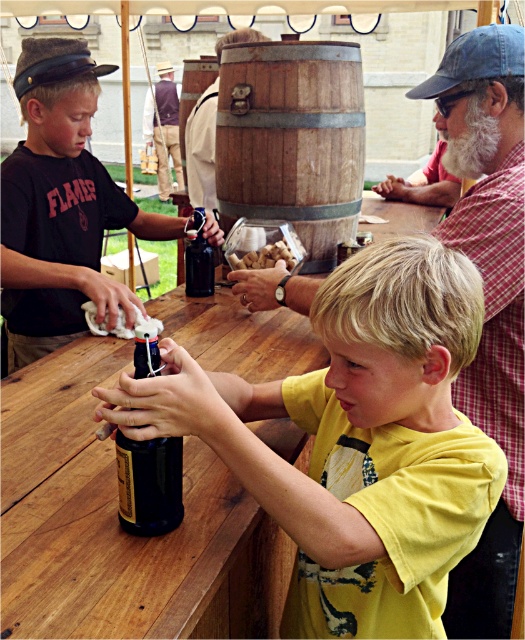
Question: Estimate the real-world distances between objects in this image. Which object is farther from the yellow matte shirt at center?

Choices:
 (A) brown leather vest at center
 (B) bearded man at upper right
 (C) dark blue glass bottle at center
 (D) wooden table at center

Answer: (A)

Question: Is the position of yellow matte shirt at center more distant than that of dark blue glass bottle at center?

Choices:
 (A) yes
 (B) no

Answer: (B)

Question: Is wooden barrel at center closer to the viewer compared to brown leather vest at center?

Choices:
 (A) yes
 (B) no

Answer: (A)

Question: Which object is the farthest from the bearded man at upper right?

Choices:
 (A) checkered shirt at upper right
 (B) yellow matte shirt at center
 (C) matte black shirt at left
 (D) dark brown glass bottle at center

Answer: (B)

Question: Which object appears closest to the camera in this image?

Choices:
 (A) wooden barrel at center
 (B) checkered shirt at upper right
 (C) brown leather vest at center
 (D) matte black shirt at left

Answer: (B)

Question: Does brown leather vest at center come behind dark brown glass bottle at center?

Choices:
 (A) yes
 (B) no

Answer: (A)